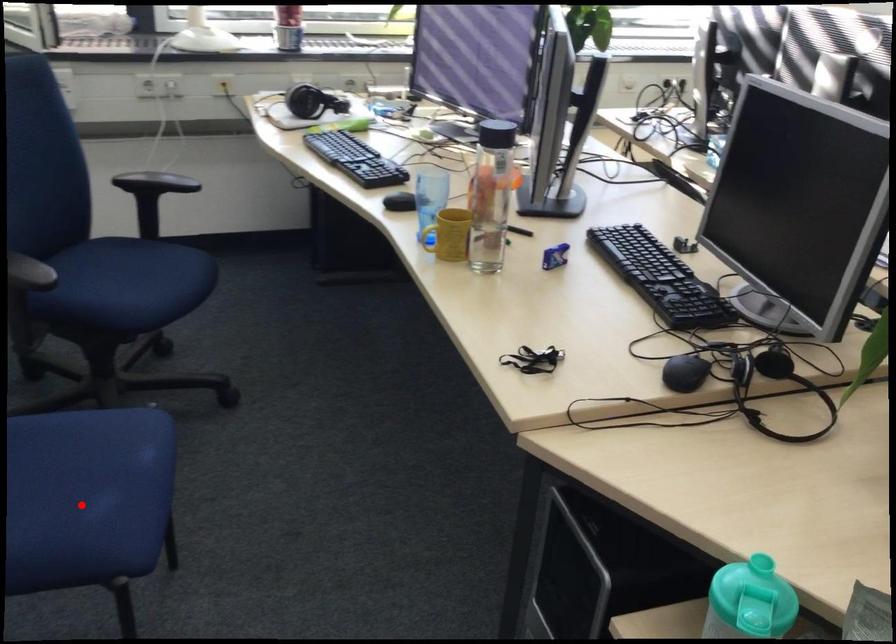
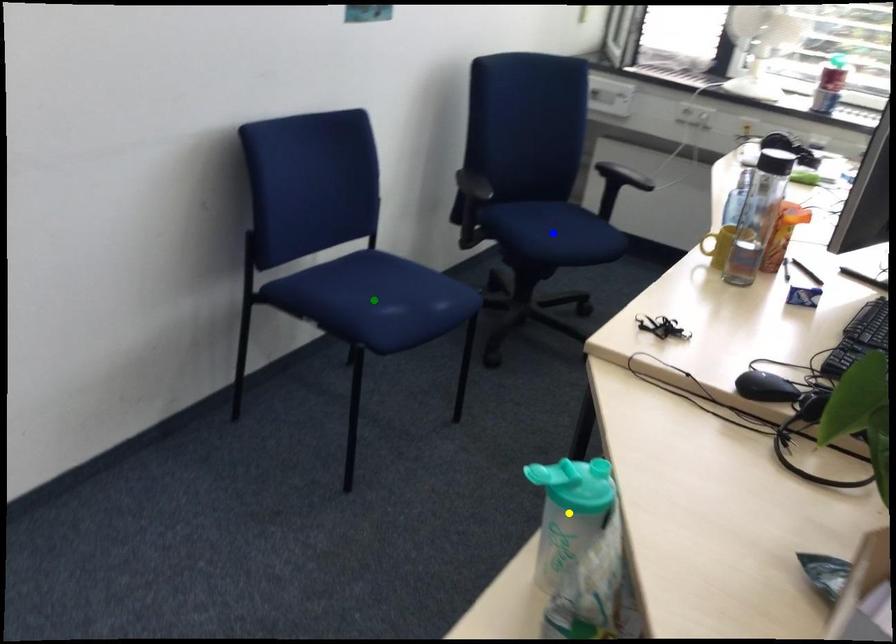
Question: I am providing you with two images of the same scene from different viewpoints. A red point is marked on the first image. You are given multiple points on the second image. Can you choose the point in image 2 that corresponds to the point in image 1?

Choices:
 (A) blue point
 (B) yellow point
 (C) green point

Answer: (C)